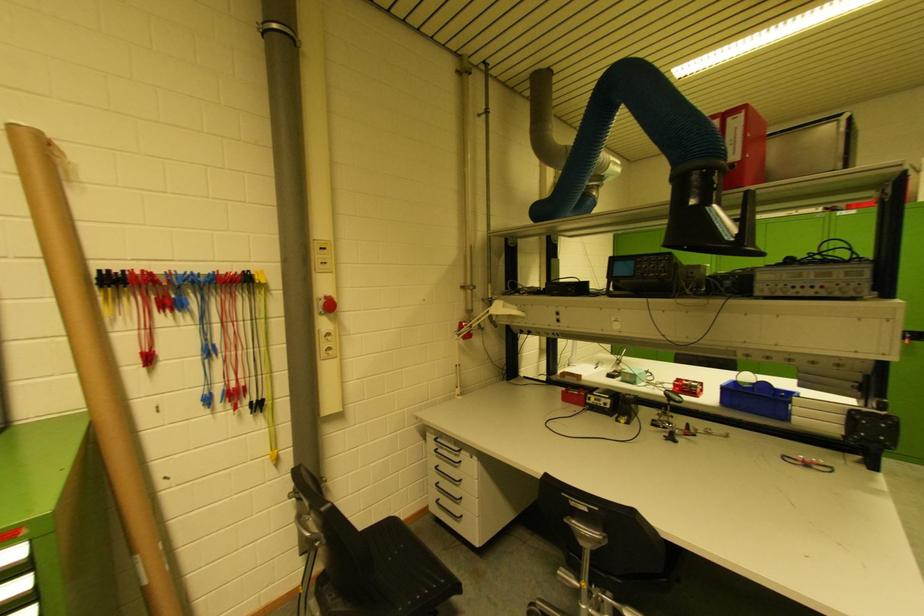
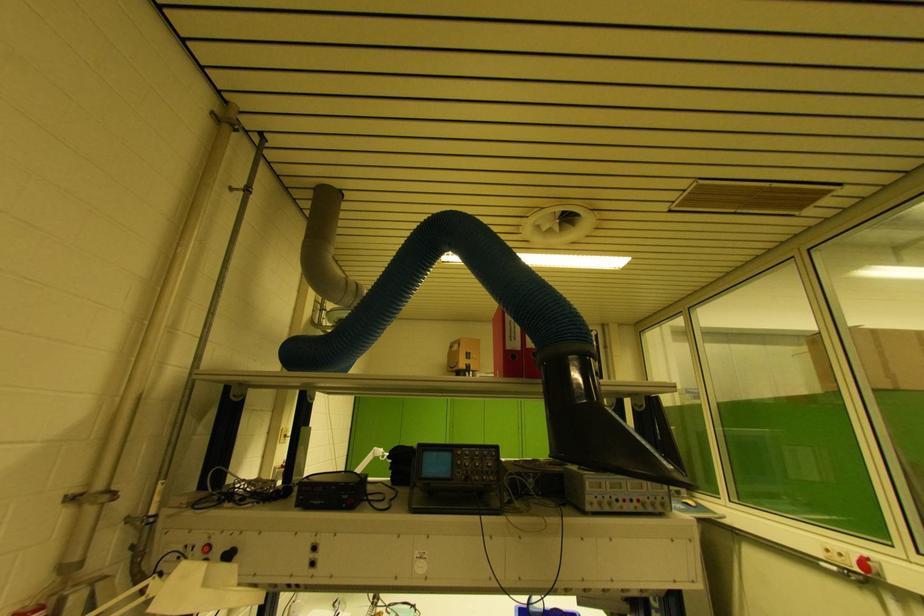
How did the camera likely rotate?

The camera rotated toward right-up.